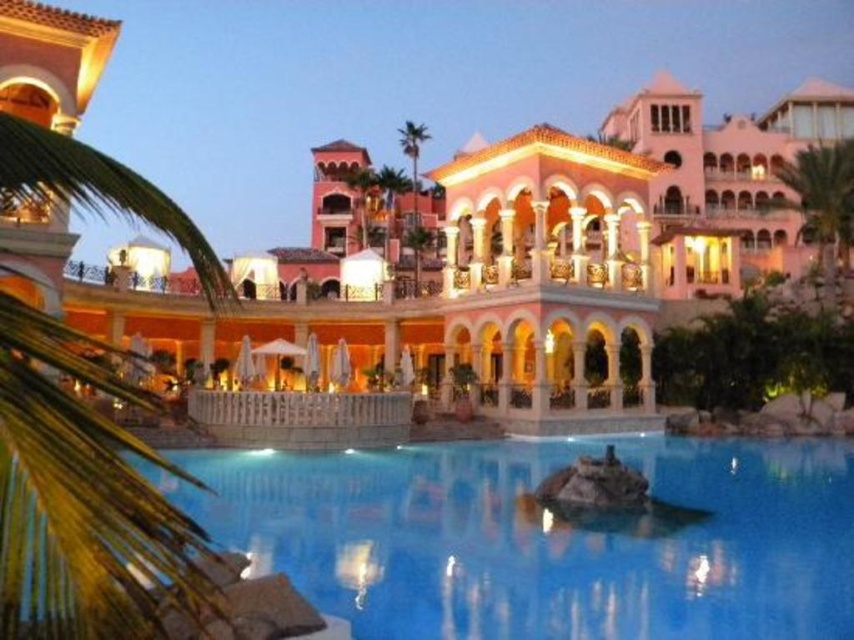
Question: Is green leafy palm tree at upper right behind green leafy palm tree at center?

Choices:
 (A) no
 (B) yes

Answer: (B)

Question: Which of these objects is positioned closest to the clear glass pool at center?

Choices:
 (A) green leafy palm tree at upper right
 (B) green leafy palm tree at center

Answer: (B)

Question: Can you confirm if clear glass pool at center is positioned below green leafy palm tree at center?

Choices:
 (A) yes
 (B) no

Answer: (A)

Question: Which point is farther to the camera?

Choices:
 (A) (407, 122)
 (B) (309, 541)

Answer: (A)

Question: Can you confirm if green leafy palm tree at upper right is wider than green leafy palm tree at center?

Choices:
 (A) yes
 (B) no

Answer: (A)

Question: Which object is positioned farthest from the green leafy palm tree at center?

Choices:
 (A) clear glass pool at center
 (B) green leafy palm tree at upper right

Answer: (B)